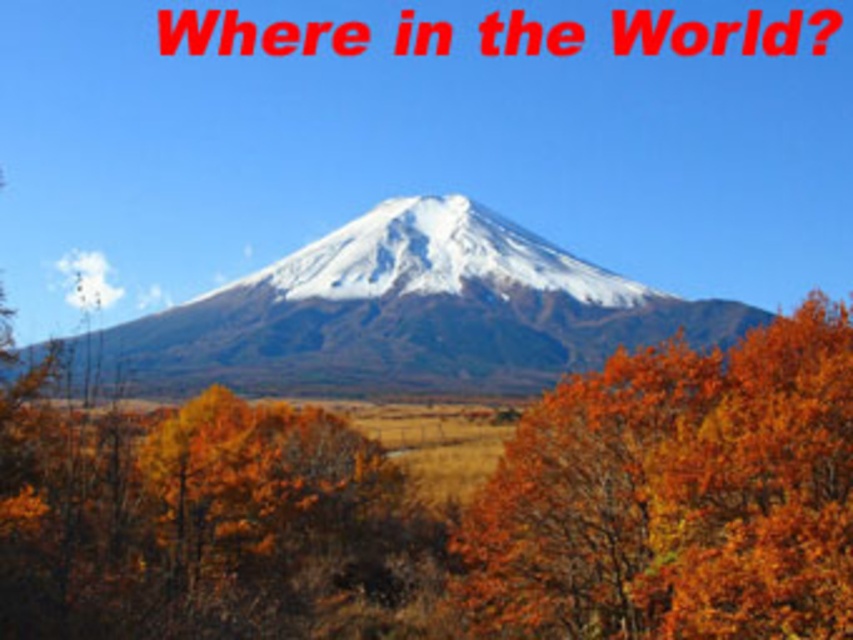
Question: Which point is farther to the camera?

Choices:
 (A) orange matte tree at right
 (B) white snow-covered mountain at center

Answer: (B)

Question: Is orange matte tree at right behind white snow-covered mountain at center?

Choices:
 (A) no
 (B) yes

Answer: (A)

Question: Can you confirm if orange matte tree at right is thinner than white snow-covered mountain at center?

Choices:
 (A) yes
 (B) no

Answer: (A)

Question: Is orange matte tree at right positioned at the back of white snow-covered mountain at center?

Choices:
 (A) yes
 (B) no

Answer: (B)

Question: Which object is farther from the camera taking this photo?

Choices:
 (A) white snow-covered mountain at center
 (B) orange matte tree at right

Answer: (A)